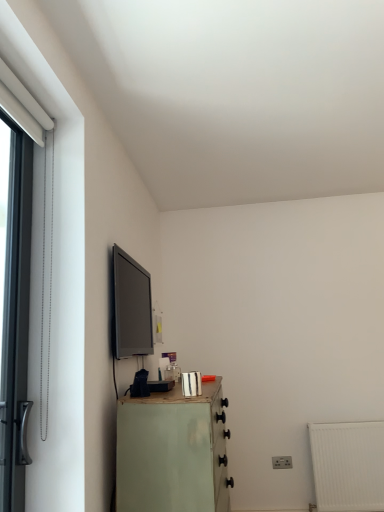
What do you see at coordinates (191, 384) in the screenshot? This screenshot has width=384, height=512. I see `metallic silver canister at lower center` at bounding box center [191, 384].

The image size is (384, 512). What do you see at coordinates (172, 452) in the screenshot? I see `light green painted wood chest of drawers at lower left` at bounding box center [172, 452].

The image size is (384, 512). What do you see at coordinates (14, 309) in the screenshot? I see `black metal door at left` at bounding box center [14, 309].

Where is `metallic silver canister at lower center`? The height and width of the screenshot is (512, 384). metallic silver canister at lower center is located at coordinates (191, 384).

Is black metal door at left wider than light green painted wood chest of drawers at lower left?

In fact, black metal door at left might be narrower than light green painted wood chest of drawers at lower left.

How much distance is there between black metal door at left and light green painted wood chest of drawers at lower left?

A distance of 24.44 inches exists between black metal door at left and light green painted wood chest of drawers at lower left.

Does black metal door at left touch light green painted wood chest of drawers at lower left?

No, black metal door at left is not in contact with light green painted wood chest of drawers at lower left.

From the image's perspective, is black metal door at left beneath light green painted wood chest of drawers at lower left?

No.

Is light green painted wood chest of drawers at lower left wider than metallic silver canister at lower center?

Yes.

Does light green painted wood chest of drawers at lower left have a smaller size compared to metallic silver canister at lower center?

No.

Is light green painted wood chest of drawers at lower left facing towards metallic silver canister at lower center?

No, light green painted wood chest of drawers at lower left does not turn towards metallic silver canister at lower center.

From the image's perspective, between light green painted wood chest of drawers at lower left and metallic silver canister at lower center, who is located below?

light green painted wood chest of drawers at lower left.

Do you think matte black tv at upper left is within black metal door at left, or outside of it?

The correct answer is: outside.

Considering the sizes of objects matte black tv at upper left and black metal door at left in the image provided, who is smaller, matte black tv at upper left or black metal door at left?

black metal door at left is smaller.

Considering the positions of points (131, 280) and (20, 281), is point (131, 280) closer to camera compared to point (20, 281)?

That is False.

How far apart are matte black tv at upper left and black metal door at left?

They are 5.75 feet apart.

Considering the sizes of metallic silver canister at lower center and black metal door at left in the image, is metallic silver canister at lower center bigger or smaller than black metal door at left?

metallic silver canister at lower center is smaller than black metal door at left.

Is metallic silver canister at lower center at the left side of black metal door at left?

No, metallic silver canister at lower center is not to the left of black metal door at left.

Is metallic silver canister at lower center outside of black metal door at left?

metallic silver canister at lower center is positioned outside black metal door at left.

What's the angular difference between metallic silver canister at lower center and black metal door at left's facing directions?

0.436 degrees separate the facing orientations of metallic silver canister at lower center and black metal door at left.

Is metallic silver canister at lower center inside or outside of matte black tv at upper left?

metallic silver canister at lower center is not enclosed by matte black tv at upper left.

Does point (186, 386) appear closer or farther from the camera than point (148, 351)?

Clearly, point (186, 386) is closer to the camera than point (148, 351).

Does metallic silver canister at lower center have a lesser width compared to matte black tv at upper left?

No.

Is there a large distance between metallic silver canister at lower center and matte black tv at upper left?

metallic silver canister at lower center is positioned a significant distance from matte black tv at upper left.

Between light green painted wood chest of drawers at lower left and black metal door at left, which one has more height?

With more height is black metal door at left.

Find the location of a particular element. the chest of drawers lying below the black metal door at left (from the image's perspective) is located at coordinates (172, 452).

From the image's perspective, which one is positioned lower, light green painted wood chest of drawers at lower left or black metal door at left?

light green painted wood chest of drawers at lower left is shown below in the image.

Can you confirm if light green painted wood chest of drawers at lower left is thinner than black metal door at left?

In fact, light green painted wood chest of drawers at lower left might be wider than black metal door at left.

From the image's perspective, who appears lower, matte black tv at upper left or light green painted wood chest of drawers at lower left?

light green painted wood chest of drawers at lower left appears lower in the image.

Can you confirm if matte black tv at upper left is positioned to the right of light green painted wood chest of drawers at lower left?

In fact, matte black tv at upper left is to the left of light green painted wood chest of drawers at lower left.

Is light green painted wood chest of drawers at lower left at the back of matte black tv at upper left?

matte black tv at upper left is not turned away from light green painted wood chest of drawers at lower left.

Can you see matte black tv at upper left touching light green painted wood chest of drawers at lower left?

No, matte black tv at upper left is not making contact with light green painted wood chest of drawers at lower left.

Locate an element on the screen. door above the light green painted wood chest of drawers at lower left (from a real-world perspective) is located at coordinates (14, 309).

Locate an element on the screen. chest of drawers to the left of metallic silver canister at lower center is located at coordinates (172, 452).

Looking at the image, which one is located further to light green painted wood chest of drawers at lower left, metallic silver canister at lower center or black metal door at left?

Among the two, black metal door at left is located further to light green painted wood chest of drawers at lower left.

When comparing their distances from black metal door at left, does metallic silver canister at lower center or light green painted wood chest of drawers at lower left seem further?

Based on the image, metallic silver canister at lower center appears to be further to black metal door at left.

Based on the photo, considering their positions, is metallic silver canister at lower center positioned further to light green painted wood chest of drawers at lower left than matte black tv at upper left?

matte black tv at upper left.

From the image, which object appears to be nearer to matte black tv at upper left, metallic silver canister at lower center or light green painted wood chest of drawers at lower left?

light green painted wood chest of drawers at lower left is positioned closer to the anchor matte black tv at upper left.

Estimate the real-world distances between objects in this image. Which object is closer to metallic silver canister at lower center, black metal door at left or light green painted wood chest of drawers at lower left?

light green painted wood chest of drawers at lower left is positioned closer to the anchor metallic silver canister at lower center.

Estimate the real-world distances between objects in this image. Which object is closer to metallic silver canister at lower center, light green painted wood chest of drawers at lower left or black metal door at left?

light green painted wood chest of drawers at lower left is positioned closer to the anchor metallic silver canister at lower center.

Looking at the image, which one is located closer to light green painted wood chest of drawers at lower left, black metal door at left or metallic silver canister at lower center?

Based on the image, metallic silver canister at lower center appears to be nearer to light green painted wood chest of drawers at lower left.

Based on their spatial positions, is matte black tv at upper left or light green painted wood chest of drawers at lower left closer to black metal door at left?

light green painted wood chest of drawers at lower left is closer to black metal door at left.

Identify the location of appliance between black metal door at left and light green painted wood chest of drawers at lower left vertically. This screenshot has width=384, height=512. (191, 384).

Locate an element on the screen. appliance between matte black tv at upper left and light green painted wood chest of drawers at lower left from top to bottom is located at coordinates (191, 384).

Where is `window screen between black metal door at left and light green painted wood chest of drawers at lower left vertically`? The width and height of the screenshot is (384, 512). window screen between black metal door at left and light green painted wood chest of drawers at lower left vertically is located at coordinates (131, 306).

Locate an element on the screen. window screen located between black metal door at left and metallic silver canister at lower center in the left-right direction is located at coordinates click(131, 306).